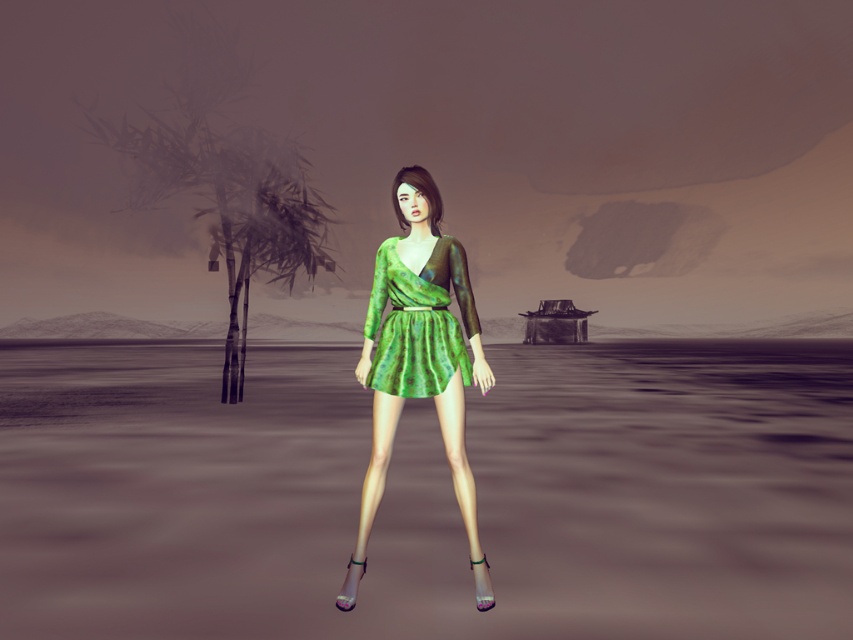
Question: Considering the real-world distances, which object is closest to the green glossy water at center?

Choices:
 (A) green textured dress at center
 (B) green shiny dress at center

Answer: (A)

Question: Which object is the closest to the green textured dress at center?

Choices:
 (A) green shiny dress at center
 (B) green glossy water at center

Answer: (A)

Question: Does green glossy water at center appear over green shiny dress at center?

Choices:
 (A) yes
 (B) no

Answer: (B)

Question: Can you confirm if green glossy water at center is wider than green shiny dress at center?

Choices:
 (A) yes
 (B) no

Answer: (A)

Question: Which object appears farthest from the camera in this image?

Choices:
 (A) green textured dress at center
 (B) green glossy water at center
 (C) green shiny dress at center

Answer: (A)

Question: Does green shiny dress at center lie behind green textured dress at center?

Choices:
 (A) no
 (B) yes

Answer: (A)